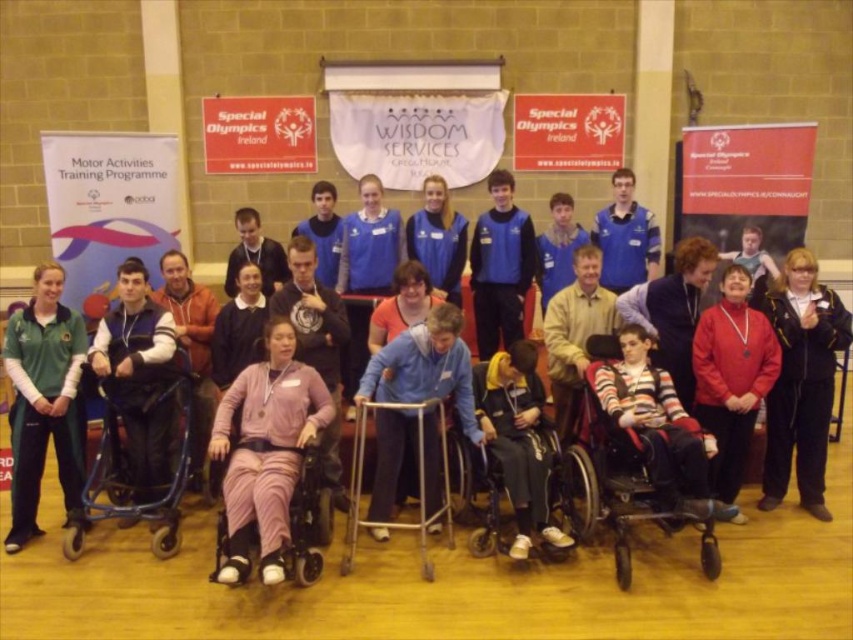
You are standing at the center of the gymnasium and want to reach the black leather jacket at lower right. Which direction should you move to get there?

You should move towards the lower right direction to reach the black leather jacket at lower right, as its position is at point (801, 381).

You are organizing a space in the gymnasium and need to arrange items from smallest to largest. Given the blue fabric jacket at center and the silver metallic walker at center, which should come first?

The blue fabric jacket at center should come first in the arrangement because it occupies less space than the silver metallic walker at center.

You are a photographer setting up for a group photo in a gymnasium. You notice the green fleece jacket at left and the black plastic wheelchair at center. Which object is positioned higher in the image?

The green fleece jacket at left is located above the black plastic wheelchair at center in the image.